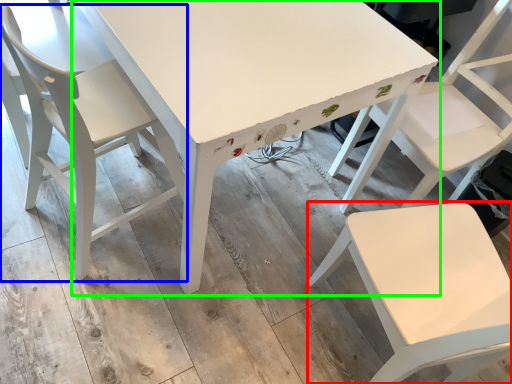
Question: Considering the real-world distances, which object is closest to chair (highlighted by a red box)? chair (highlighted by a blue box) or table (highlighted by a green box).

Choices:
 (A) chair
 (B) table

Answer: (B)